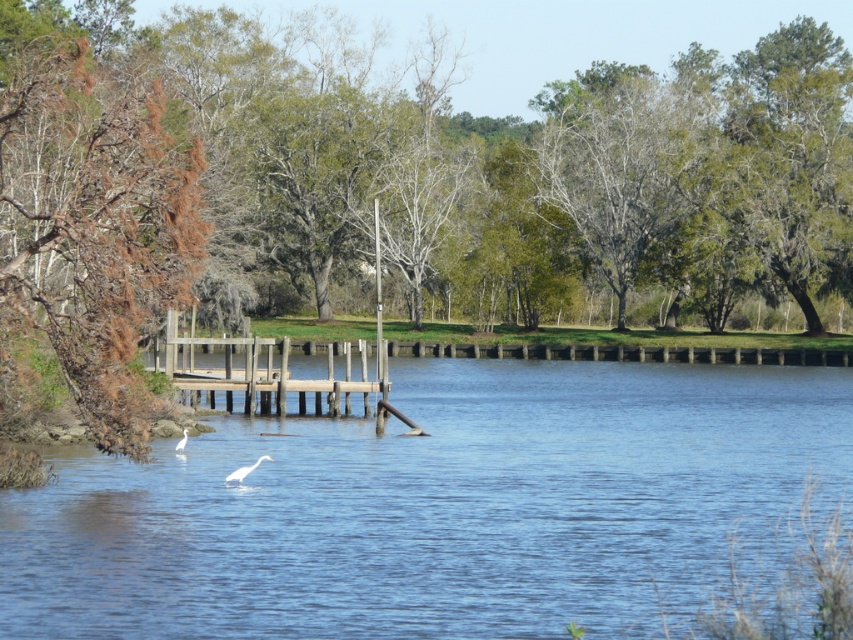
Is point (653, 372) positioned in front of point (337, 401)?

No, (653, 372) is behind (337, 401).

Is blue water at center shorter than weathered wood dock at left?

Indeed, blue water at center has a lesser height compared to weathered wood dock at left.

Between point (689, 614) and point (364, 348), which one is positioned in front?

Point (689, 614) is more forward.

This screenshot has width=853, height=640. In order to click on blue water at center in this screenshot , I will do `click(438, 508)`.

Describe the element at coordinates (260, 371) in the screenshot. The image size is (853, 640). I see `weathered wood dock at left` at that location.

Can you confirm if weathered wood dock at left is bigger than white matte bird at center?

Yes, weathered wood dock at left is bigger than white matte bird at center.

Which is behind, point (357, 346) or point (186, 433)?

The point (357, 346) is behind.

This screenshot has height=640, width=853. Find the location of `weathered wood dock at left`. weathered wood dock at left is located at coordinates (260, 371).

Who is positioned more to the right, white smooth bird at lower center or white matte bird at center?

white smooth bird at lower center

How much distance is there between white smooth bird at lower center and white matte bird at center?

white smooth bird at lower center is 8.58 meters from white matte bird at center.

Measure the distance between white smooth bird at lower center and camera.

white smooth bird at lower center and camera are 24.84 meters apart.

Locate an element on the screen. white smooth bird at lower center is located at coordinates (244, 470).